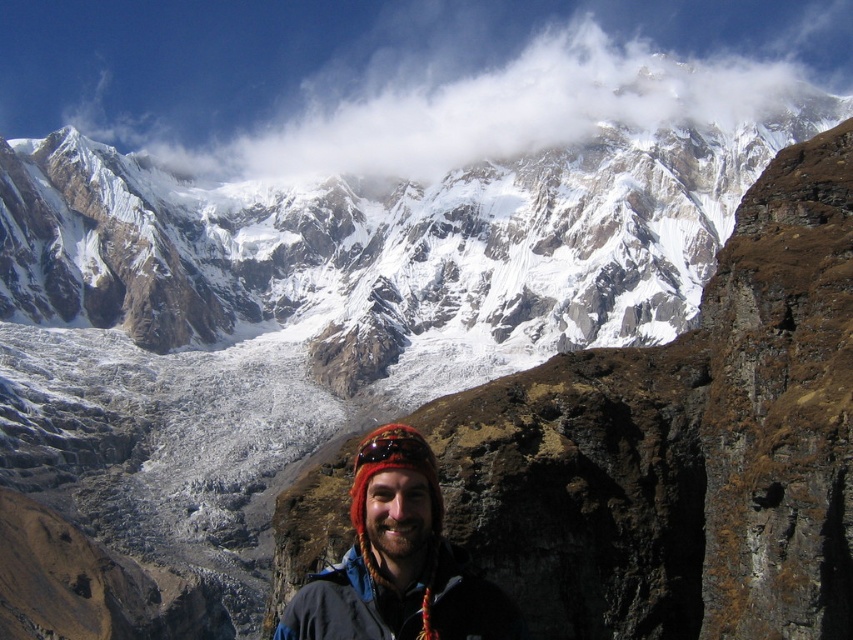
You are a photographer planning to capture the snowcapped mountains in the distance. You notice a white fluffy cloud at upper center marked by point (428, 76). Where should you position your camera to ensure the cloud is centered in your shot?

Position your camera so that the white fluffy cloud at upper center marked by point (428, 76) is centered in your viewfinder. This ensures the cloud will be at the center of the image.

You are a hiker trying to locate your gear. You see a knitted wool hat at center and a dark blue fleece jacket at lower center. Which item is positioned more to the left?

The knitted wool hat at center is positioned more to the left than the dark blue fleece jacket at lower center.